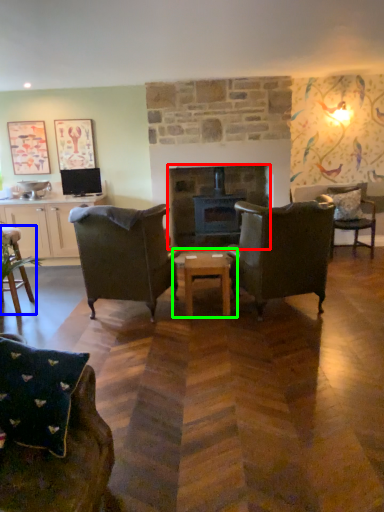
Question: Which is farther away from fireplace (highlighted by a red box)? chair (highlighted by a blue box) or coffee table (highlighted by a green box)?

Choices:
 (A) chair
 (B) coffee table

Answer: (A)